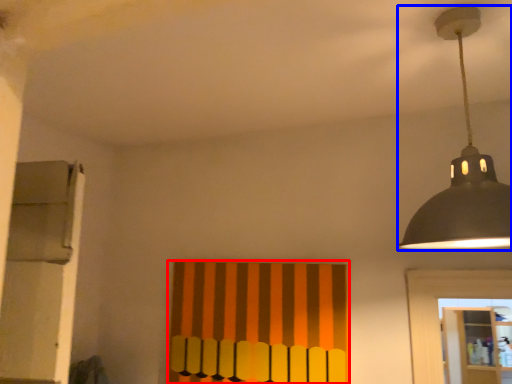
Question: Which object is closer to the camera taking this photo, curtain (highlighted by a red box) or lamp (highlighted by a blue box)?

Choices:
 (A) curtain
 (B) lamp

Answer: (B)